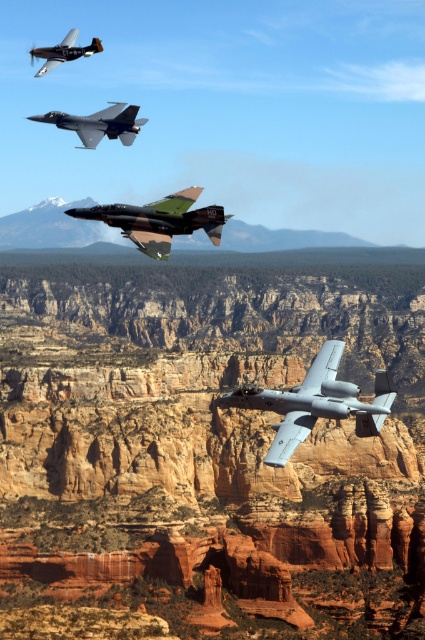
Question: Estimate the real-world distances between objects in this image. Which object is closer to the silver metallic jet at center?

Choices:
 (A) camouflage paint fighter jet at center
 (B) brushed metal airplane at upper left
 (C) camouflage paint fighter jet at upper center

Answer: (A)

Question: Which of the following is the closest to the observer?

Choices:
 (A) rustic stone cliff at center
 (B) camouflage paint fighter jet at center
 (C) brushed metal airplane at upper left
 (D) camouflage paint fighter jet at upper center

Answer: (B)

Question: Which of the following is the farthest from the observer?

Choices:
 (A) (150, 252)
 (B) (316, 305)
 (C) (385, 384)

Answer: (B)

Question: Is the position of silver metallic jet at center less distant than that of camouflage paint fighter jet at center?

Choices:
 (A) no
 (B) yes

Answer: (B)

Question: Can you confirm if silver metallic jet at center is positioned below camouflage paint fighter jet at center?

Choices:
 (A) yes
 (B) no

Answer: (A)

Question: Can you confirm if camouflage paint fighter jet at center is bigger than camouflage paint fighter jet at upper center?

Choices:
 (A) no
 (B) yes

Answer: (A)